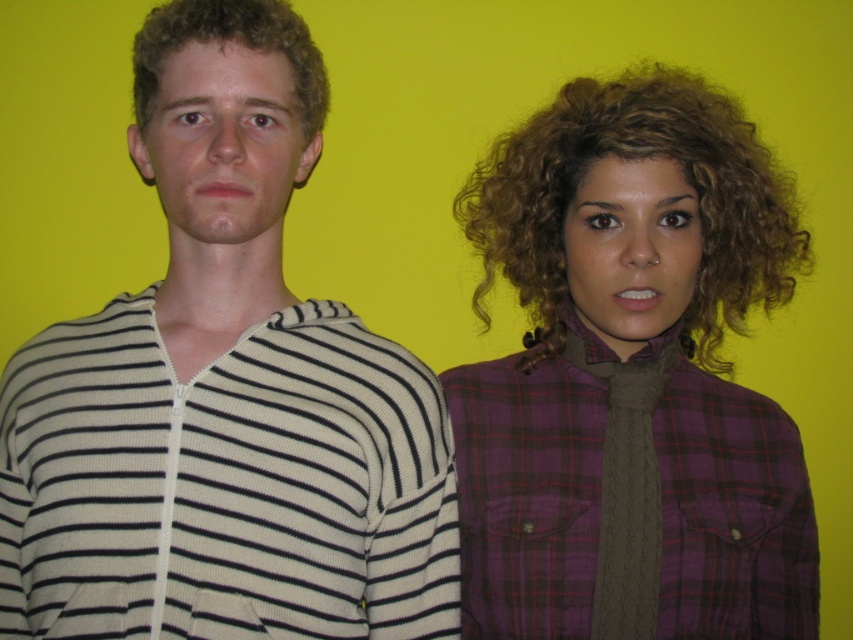
Question: Which object appears closest to the camera in this image?

Choices:
 (A) white striped sweater at left
 (B) curly blonde hair at left

Answer: (A)

Question: In this image, where is purple plaid shirt at right located relative to curly blonde hair at left?

Choices:
 (A) above
 (B) below

Answer: (B)

Question: Can you confirm if white striped sweater at left is thinner than curly blonde hair at left?

Choices:
 (A) yes
 (B) no

Answer: (B)

Question: Which object is closer to the camera taking this photo?

Choices:
 (A) purple plaid shirt at right
 (B) curly blonde hair at left
 (C) white striped sweater at left

Answer: (C)

Question: Is purple plaid shirt at right further to camera compared to curly blonde hair at left?

Choices:
 (A) no
 (B) yes

Answer: (B)

Question: Which point is closer to the camera?

Choices:
 (A) (532, 516)
 (B) (223, 44)

Answer: (B)